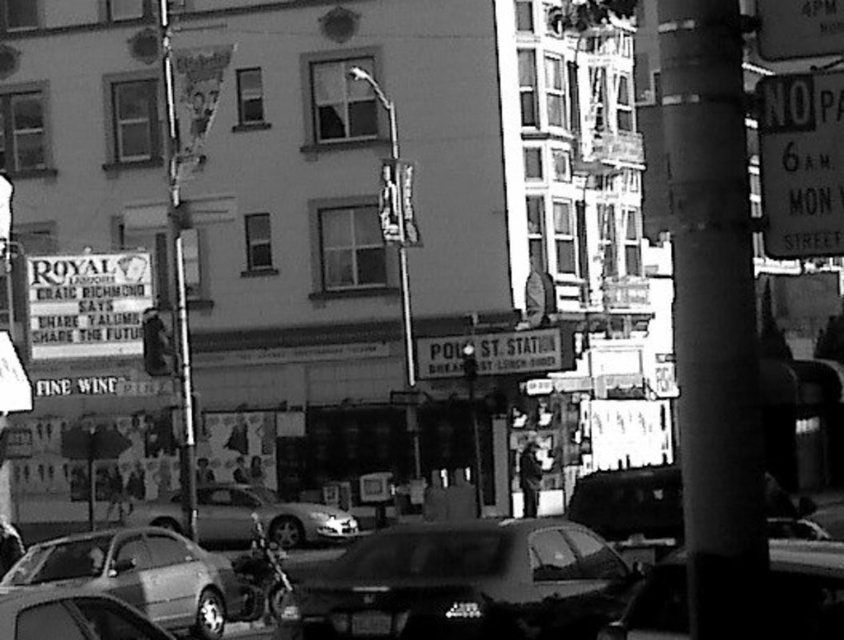
You are a pedestrian standing on the street and see the shiny black sedan at center and the white paper sign at left. Which object is nearer to you?

The shiny black sedan at center is closer to the viewer than the white paper sign at left.

You are a delivery person trying to park your shiny black sedan at center in a spot that is currently occupied by a white paper sign at left. Can your car fit in the space if you remove the sign?

The shiny black sedan at center is wider than the white paper sign at left, so it may not fit in the space if you remove the sign.

You are a photographer standing in the middle of the street. You notice two points in the scene, one at coordinate point (839, 560) and another at point (153, 324). Which point would appear larger in your camera view?

Point (839, 560) is closer to the camera than point (153, 324), so it would appear larger in the camera view.